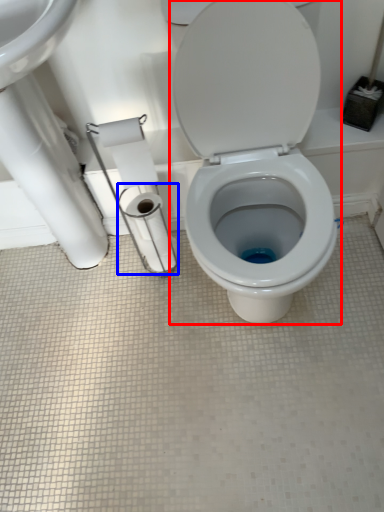
Question: Which of the following is the farthest to the observer, toilet (highlighted by a red box) or toilet paper (highlighted by a blue box)?

Choices:
 (A) toilet
 (B) toilet paper

Answer: (B)